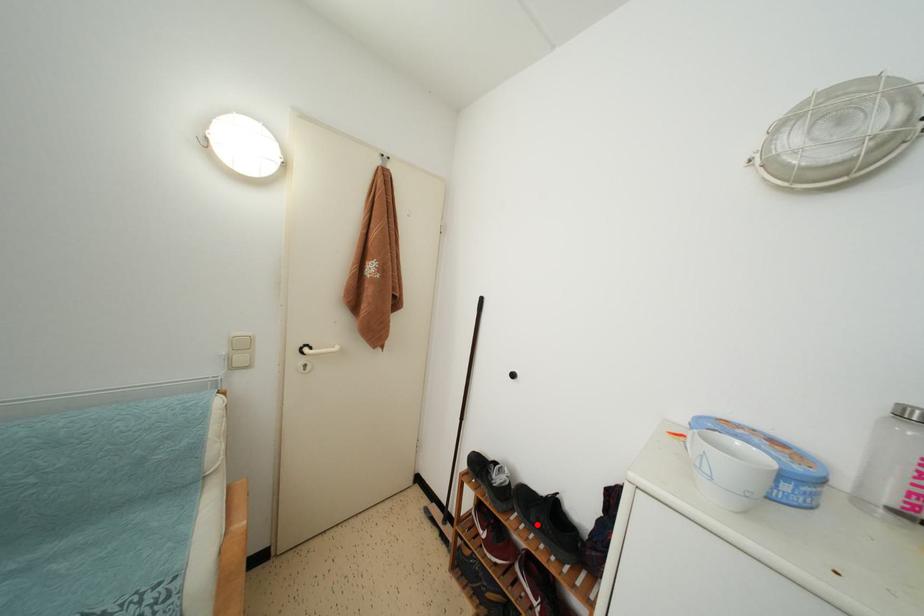
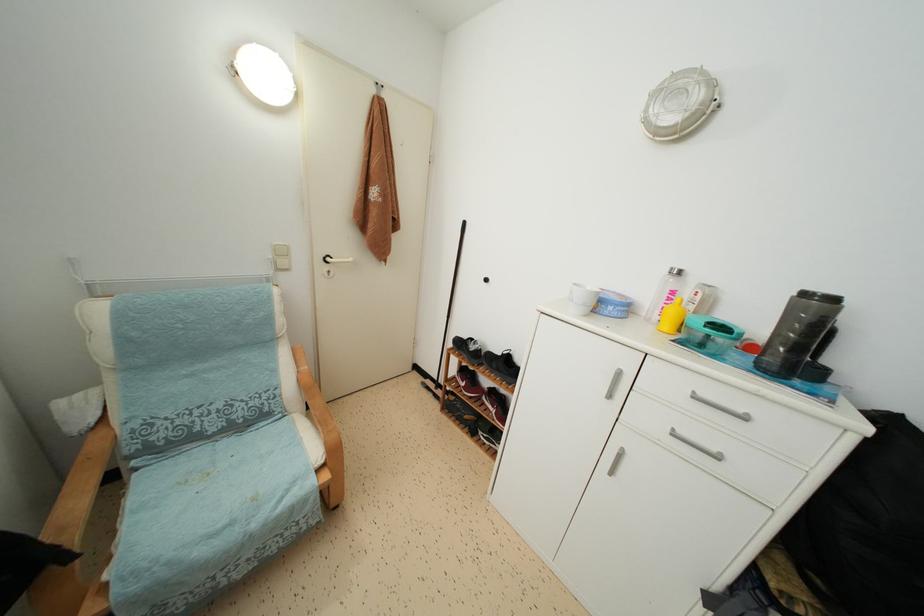
The point at the highlighted location is marked in the first image. Where is the corresponding point in the second image?

(497, 371)